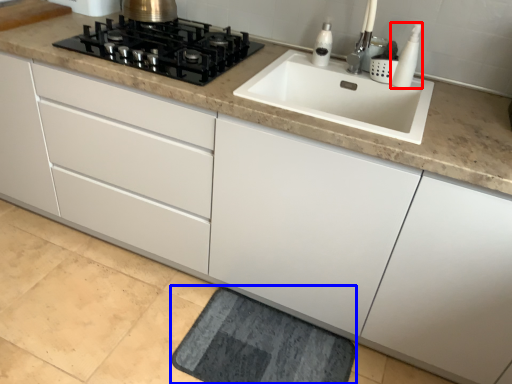
Question: Which object appears farthest to the camera in this image, soap dispenser (highlighted by a red box) or bath mat (highlighted by a blue box)?

Choices:
 (A) soap dispenser
 (B) bath mat

Answer: (A)